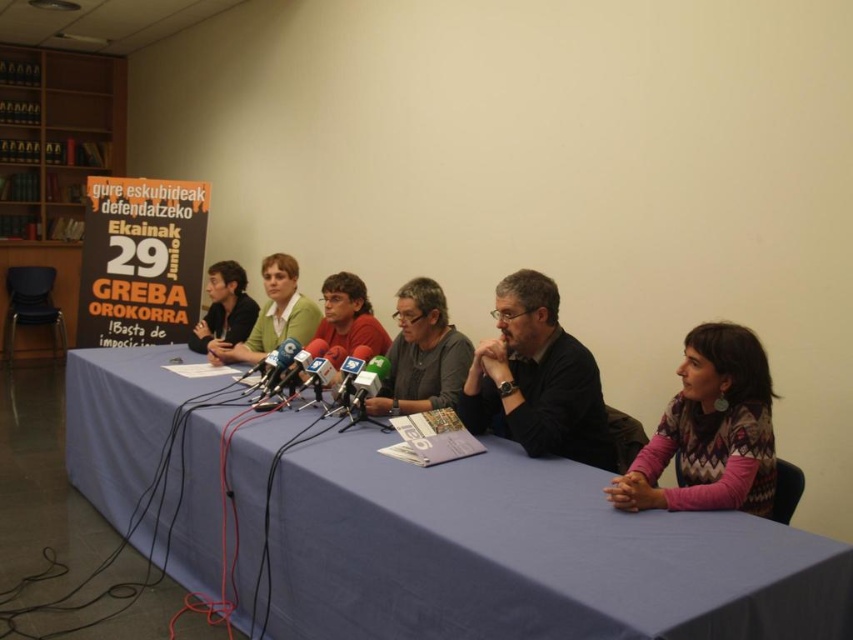
Question: Is knitted sweater at lower right positioned before dark gray sweater at center?

Choices:
 (A) yes
 (B) no

Answer: (A)

Question: Can you confirm if blue fabric table at center is positioned to the left of wooden bookshelf at left?

Choices:
 (A) yes
 (B) no

Answer: (B)

Question: Where is knitted sweater at lower right located in relation to red matte shirt at center in the image?

Choices:
 (A) right
 (B) left

Answer: (A)

Question: Estimate the real-world distances between objects in this image. Which object is farther from the green fabric shirt at center?

Choices:
 (A) metallic silver microphone at center
 (B) blue fabric table at center
 (C) dark gray sweater at center

Answer: (C)

Question: Based on their relative distances, which object is nearer to the metallic silver microphone at center?

Choices:
 (A) green fabric shirt at center
 (B) red matte shirt at center
 (C) blue fabric table at center
 (D) knitted sweater at lower right

Answer: (B)

Question: Which point is closer to the camera?

Choices:
 (A) matte black shirt at center
 (B) red matte shirt at center
 (C) gray matte shirt at center
 (D) green fabric shirt at center

Answer: (C)